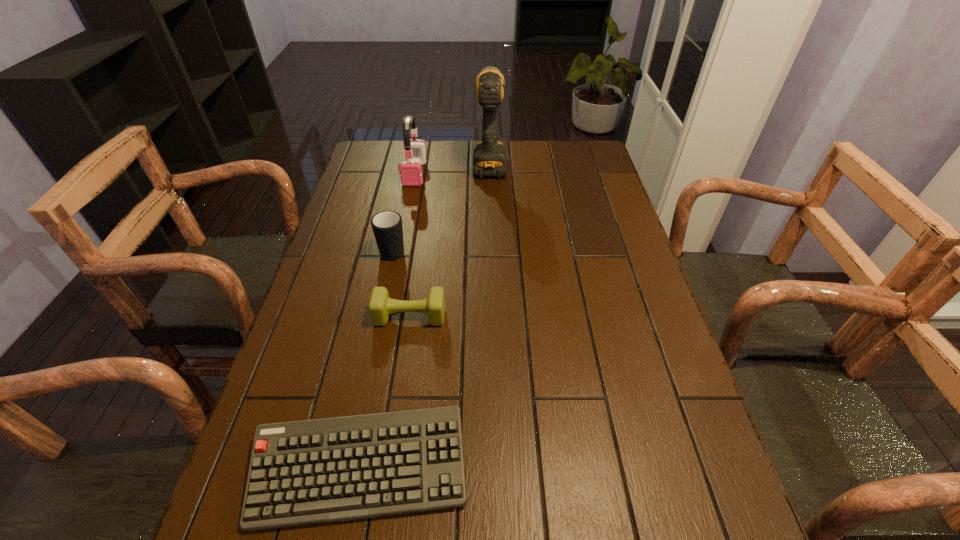
At what (x,y) coordinates should I click in order to perform the action: click on vacant space that's between the earphone and the dumbbell. Please return your answer as a coordinate pair (x, y). The width and height of the screenshot is (960, 540). Looking at the image, I should click on (412, 245).

Locate an element on the screen. This screenshot has height=540, width=960. free space between the second nearest object and the nearest object is located at coordinates (385, 393).

This screenshot has height=540, width=960. Identify the location of empty space that is in between the mug and the computer keyboard. (377, 359).

Where is `free space between the earphone and the tallest object`? free space between the earphone and the tallest object is located at coordinates [x=452, y=167].

You are a GUI agent. You are given a task and a screenshot of the screen. Output one action in this format:
    pyautogui.click(x=<x>, y=<y>)
    Task: Click on the free space between the tallest object and the mug
    The image size is (960, 540).
    Given the screenshot: What is the action you would take?
    pyautogui.click(x=442, y=205)

Locate an element on the screen. The width and height of the screenshot is (960, 540). free spot between the tallest object and the mug is located at coordinates (442, 205).

You are a GUI agent. You are given a task and a screenshot of the screen. Output one action in this format:
    pyautogui.click(x=<x>, y=<y>)
    Task: Click on the free point between the drill and the shortest object
    The image size is (960, 540).
    Given the screenshot: What is the action you would take?
    pyautogui.click(x=425, y=315)

Image resolution: width=960 pixels, height=540 pixels. Identify the location of blank region between the second tallest object and the dumbbell. (412, 245).

This screenshot has height=540, width=960. I want to click on vacant space in between the earphone and the third nearest object, so click(404, 211).

This screenshot has height=540, width=960. I want to click on object that can be found as the second closest to the computer keyboard, so click(387, 227).